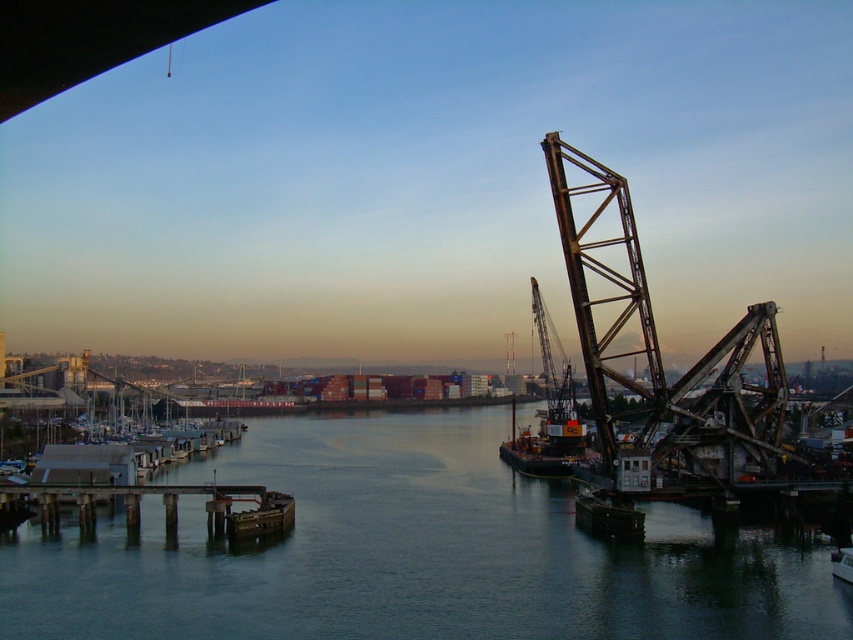
Is dark blue water at center wider than metallic gray crane at center right?

Indeed, dark blue water at center has a greater width compared to metallic gray crane at center right.

Does point (113, 538) come in front of point (537, 467)?

Yes, point (113, 538) is closer to viewer.

Identify the location of dark blue water at center. (410, 552).

The image size is (853, 640). I want to click on dark blue water at center, so click(x=410, y=552).